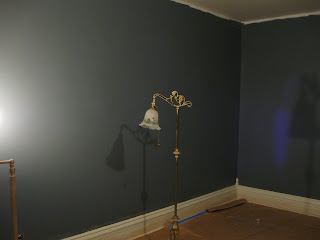
Locate an element on the screen. This screenshot has width=320, height=240. moulding is located at coordinates (268, 198).